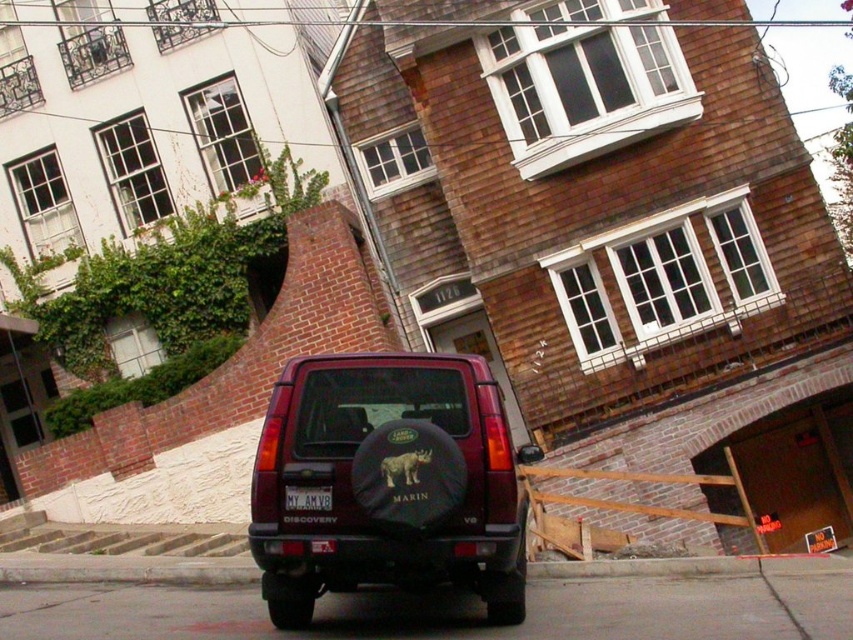
Question: Can you confirm if maroon matte jeep at center is wider than concrete at lower center?

Choices:
 (A) yes
 (B) no

Answer: (B)

Question: Where is concrete at lower center located in relation to black matte license plate at center in the image?

Choices:
 (A) below
 (B) above

Answer: (A)

Question: Which object is positioned closest to the black matte license plate at center?

Choices:
 (A) concrete at lower center
 (B) maroon matte jeep at center

Answer: (B)

Question: Is concrete at lower center to the right of black matte license plate at center from the viewer's perspective?

Choices:
 (A) yes
 (B) no

Answer: (A)

Question: Which of the following is the farthest from the observer?

Choices:
 (A) (288, 420)
 (B) (28, 566)

Answer: (B)

Question: Considering the real-world distances, which object is closest to the maroon matte jeep at center?

Choices:
 (A) black matte license plate at center
 (B) concrete at lower center

Answer: (A)